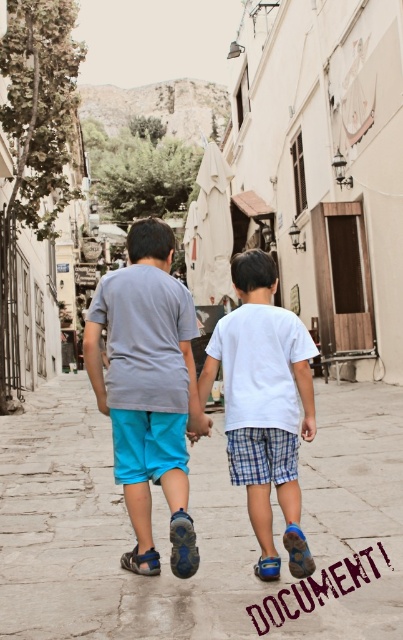
Which of these two, smooth stone pavement at center or white cotton shirt at center, stands shorter?

smooth stone pavement at center

Locate an element on the screen. This screenshot has width=403, height=640. smooth stone pavement at center is located at coordinates (195, 529).

Who is more forward, (153, 259) or (297, 522)?

Point (297, 522)

Is matte gray t-shirt at center above white cotton shirt at center?

Indeed, matte gray t-shirt at center is positioned over white cotton shirt at center.

Which is in front, point (128, 384) or point (270, 337)?

Point (270, 337) is more forward.

Find the location of a particular element. This screenshot has height=640, width=403. matte gray t-shirt at center is located at coordinates (147, 388).

Can you confirm if smooth stone pavement at center is smaller than matte gray t-shirt at center?

No, smooth stone pavement at center is not smaller than matte gray t-shirt at center.

Between smooth stone pavement at center and matte gray t-shirt at center, which one has less height?

With less height is smooth stone pavement at center.

Is point (58, 516) closer to camera compared to point (168, 348)?

That is False.

Identify the location of smooth stone pavement at center. (195, 529).